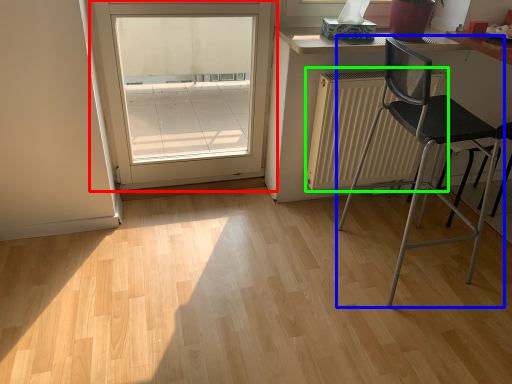
Question: Which is farther away from door (highlighted by a red box)? chair (highlighted by a blue box) or radiator (highlighted by a green box)?

Choices:
 (A) chair
 (B) radiator

Answer: (A)